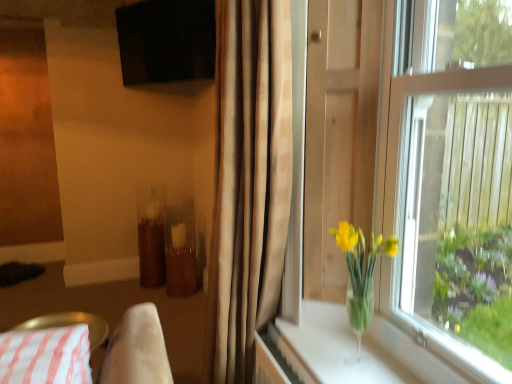
The image size is (512, 384). Identify the location of white striped fabric at lower left. (137, 350).

Find the location of a particular element. beige fabric curtain at center is located at coordinates (249, 182).

What is the approximate height of translucent glass vase at window?

The height of translucent glass vase at window is 19.06 inches.

Find the location of a particular element. The image size is (512, 384). white striped fabric at lower left is located at coordinates (137, 350).

Relative to clear glass vase at lower right, is black matte screen at upper center, the 2th window screen positioned from the right, in front or behind?

Visually, black matte screen at upper center, the 2th window screen positioned from the right, is located behind clear glass vase at lower right.

Does black matte screen at upper center, which is the second window screen from bottom to top, appear on the left side of clear glass vase at lower right?

Indeed, black matte screen at upper center, which is the second window screen from bottom to top, is positioned on the left side of clear glass vase at lower right.

Considering the relative sizes of black matte screen at upper center, the first window screen positioned from the top, and clear glass vase at lower right in the image provided, is black matte screen at upper center, the first window screen positioned from the top, shorter than clear glass vase at lower right?

In fact, black matte screen at upper center, the first window screen positioned from the top, may be taller than clear glass vase at lower right.

Can you see black matte screen at upper center, the 2th window screen positioned from the right, touching clear glass vase at lower right?

There is a gap between black matte screen at upper center, the 2th window screen positioned from the right, and clear glass vase at lower right.

Does black matte screen at upper center, the first window screen positioned from the top, touch beige fabric curtain at center?

No, black matte screen at upper center, the first window screen positioned from the top, is not touching beige fabric curtain at center.

Could beige fabric curtain at center be considered to be inside black matte screen at upper center, the first window screen positioned from the top?

No, beige fabric curtain at center is located outside of black matte screen at upper center, the first window screen positioned from the top.

What are the coordinates of `curtain on the right of the black matte screen at upper center, arranged as the 1th window screen when viewed from the back` in the screenshot? It's located at (249, 182).

Considering the sizes of black matte screen at upper center, the 2th window screen in the front-to-back sequence, and beige fabric curtain at center in the image, is black matte screen at upper center, the 2th window screen in the front-to-back sequence, wider or thinner than beige fabric curtain at center?

black matte screen at upper center, the 2th window screen in the front-to-back sequence, is thinner than beige fabric curtain at center.

Considering the points (470, 90) and (268, 101), which point is in front, point (470, 90) or point (268, 101)?

The point (470, 90) is closer.

At what (x,y) coordinates should I click in order to perform the action: click on curtain beneath the transparent glass vase at right, marked as the 2th window screen in a top-to-bottom arrangement (from a real-world perspective). Please return your answer as a coordinate pair (x, y). Looking at the image, I should click on (249, 182).

How different are the orientations of clear glass vase at lower right and translucent glass vase at window in degrees?

The angular difference between clear glass vase at lower right and translucent glass vase at window is 4.27 degrees.

From the image's perspective, is clear glass vase at lower right on top of translucent glass vase at window?

No, from the image's perspective, clear glass vase at lower right is not on top of translucent glass vase at window.

Does point (344, 332) come closer to viewer compared to point (361, 259)?

No, it is behind (361, 259).

Would you say translucent glass vase at window is part of clear glass vase at lower right's contents?

That's incorrect, translucent glass vase at window is not inside clear glass vase at lower right.

From the image's perspective, is white striped fabric at lower left on beige fabric curtain at center?

No.

Identify the location of bedding that is behind the beige fabric curtain at center. (137, 350).

Is white striped fabric at lower left completely or partially outside of beige fabric curtain at center?

Yes, white striped fabric at lower left is outside of beige fabric curtain at center.

Where is `curtain below the transparent glass vase at right, arranged as the first window screen when viewed from the front (from the image's perspective)`? The image size is (512, 384). curtain below the transparent glass vase at right, arranged as the first window screen when viewed from the front (from the image's perspective) is located at coordinates (249, 182).

In the scene shown: From the image's perspective, which is above, beige fabric curtain at center or transparent glass vase at right, arranged as the first window screen when viewed from the front?

transparent glass vase at right, arranged as the first window screen when viewed from the front, appears higher in the image.

Is beige fabric curtain at center aimed at transparent glass vase at right, marked as the 2th window screen in a top-to-bottom arrangement?

No, beige fabric curtain at center is not oriented towards transparent glass vase at right, marked as the 2th window screen in a top-to-bottom arrangement.

Measure the distance between beige fabric curtain at center and transparent glass vase at right, the second window screen positioned from the left.

beige fabric curtain at center is 71.83 centimeters from transparent glass vase at right, the second window screen positioned from the left.

Is clear glass vase at lower right surrounded by beige fabric curtain at center?

Actually, clear glass vase at lower right is outside beige fabric curtain at center.

Is point (226, 42) farther from camera compared to point (403, 370)?

Yes, point (226, 42) is behind point (403, 370).

Based on their sizes in the image, would you say beige fabric curtain at center is bigger or smaller than clear glass vase at lower right?

beige fabric curtain at center is bigger than clear glass vase at lower right.

Is beige fabric curtain at center further to the viewer compared to clear glass vase at lower right?

No, the depth of beige fabric curtain at center is less than that of clear glass vase at lower right.

Where is `window screen on the left of clear glass vase at lower right`? This screenshot has height=384, width=512. window screen on the left of clear glass vase at lower right is located at coordinates (166, 41).

Where is `window screen behind the beige fabric curtain at center`? window screen behind the beige fabric curtain at center is located at coordinates (166, 41).

Looking at the image, which one is located closer to white striped fabric at lower left, clear glass vase at lower right or beige fabric curtain at center?

Based on the image, beige fabric curtain at center appears to be nearer to white striped fabric at lower left.

Estimate the real-world distances between objects in this image. Which object is closer to clear glass vase at lower right, translucent glass vase at window or white striped fabric at lower left?

translucent glass vase at window is closer to clear glass vase at lower right.

Based on their spatial positions, is white striped fabric at lower left or transparent glass vase at right, marked as the 2th window screen in a top-to-bottom arrangement, closer to translucent glass vase at window?

transparent glass vase at right, marked as the 2th window screen in a top-to-bottom arrangement, is positioned closer to the anchor translucent glass vase at window.

From the image, which object appears to be farther from clear glass vase at lower right, beige fabric curtain at center or black matte screen at upper center, the first window screen positioned from the top?

black matte screen at upper center, the first window screen positioned from the top, lies further to clear glass vase at lower right than the other object.

Considering their positions, is beige fabric curtain at center positioned closer to translucent glass vase at window than white striped fabric at lower left?

beige fabric curtain at center is closer to translucent glass vase at window.

Considering their positions, is black matte screen at upper center, the 2th window screen positioned from the right, positioned closer to clear glass vase at lower right than beige fabric curtain at center?

beige fabric curtain at center is positioned closer to the anchor clear glass vase at lower right.

Which object lies further to the anchor point beige fabric curtain at center, white striped fabric at lower left or black matte screen at upper center, the 2th window screen positioned from the right?

Based on the image, black matte screen at upper center, the 2th window screen positioned from the right, appears to be further to beige fabric curtain at center.

Which object lies further to the anchor point transparent glass vase at right, which appears as the 1th window screen when ordered from the bottom, clear glass vase at lower right or white striped fabric at lower left?

white striped fabric at lower left is further to transparent glass vase at right, which appears as the 1th window screen when ordered from the bottom.

Identify the location of window sill between beige fabric curtain at center and translucent glass vase at window from left to right. The width and height of the screenshot is (512, 384). (335, 349).

This screenshot has width=512, height=384. Identify the location of floral arrangement situated between white striped fabric at lower left and transparent glass vase at right, which appears as the 1th window screen when ordered from the bottom, from left to right. (361, 275).

Find the location of a particular element. The height and width of the screenshot is (384, 512). window sill between beige fabric curtain at center and transparent glass vase at right, marked as the 2th window screen in a top-to-bottom arrangement is located at coordinates (335, 349).

Find the location of `window sill that lies between black matte screen at upper center, arranged as the 1th window screen when viewed from the left, and white striped fabric at lower left from top to bottom`. window sill that lies between black matte screen at upper center, arranged as the 1th window screen when viewed from the left, and white striped fabric at lower left from top to bottom is located at coordinates (335, 349).